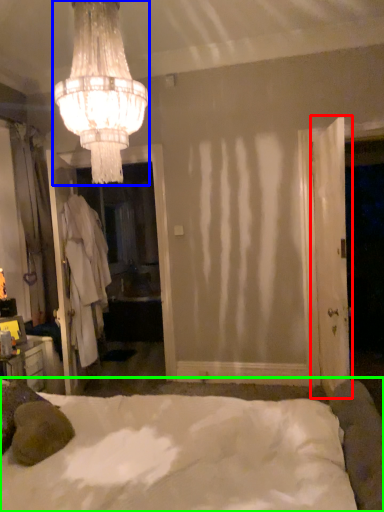
Question: Based on their relative distances, which object is nearer to door (highlighted by a red box)? Choose from lamp (highlighted by a blue box) and bed (highlighted by a green box).

Choices:
 (A) lamp
 (B) bed

Answer: (B)